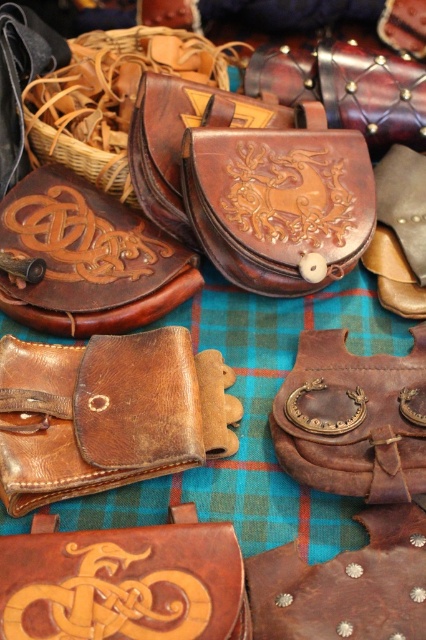
Can you confirm if brown leather pouch at upper left is wider than brown leather pouch at center?

Indeed, brown leather pouch at upper left has a greater width compared to brown leather pouch at center.

Is point (184, 275) closer to camera compared to point (423, 429)?

No, (184, 275) is further to viewer.

Locate an element on the screen. The width and height of the screenshot is (426, 640). brown leather pouch at upper left is located at coordinates (88, 259).